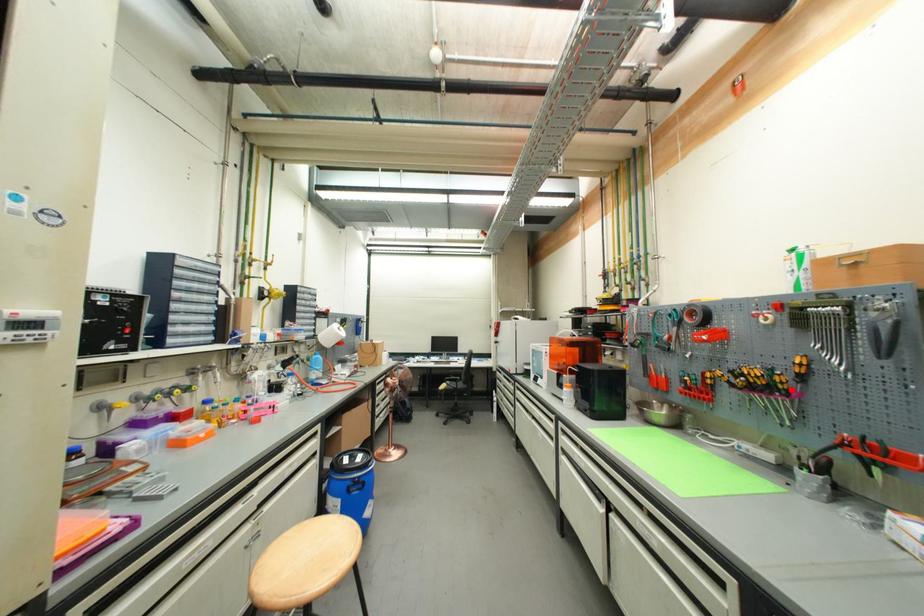
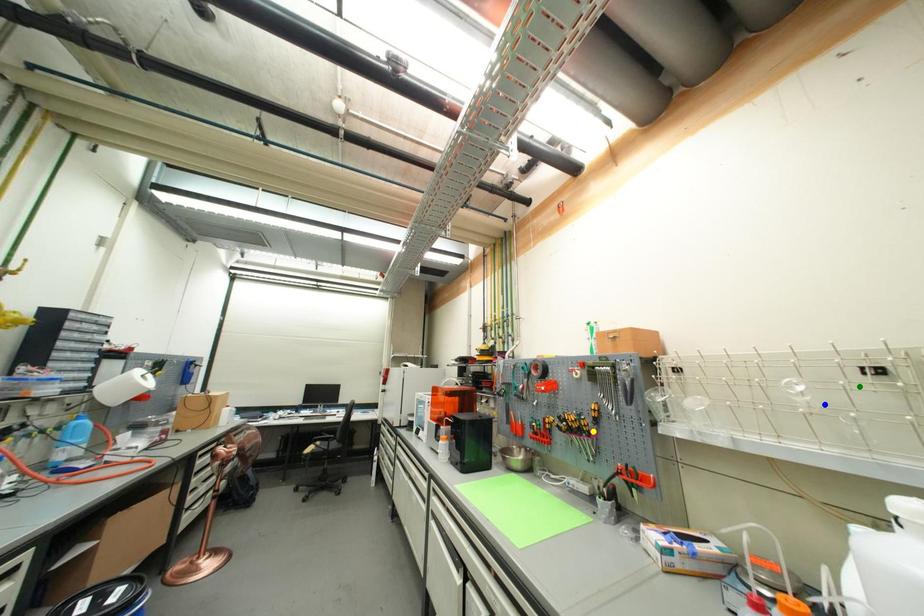
Question: I am providing you with two images of the same scene from different viewpoints. A red point is marked on the first image. You are given multiple points on the second image. Which mark in image 2 goes with the point in image 1?

Choices:
 (A) blue point
 (B) green point
 (C) yellow point

Answer: (C)